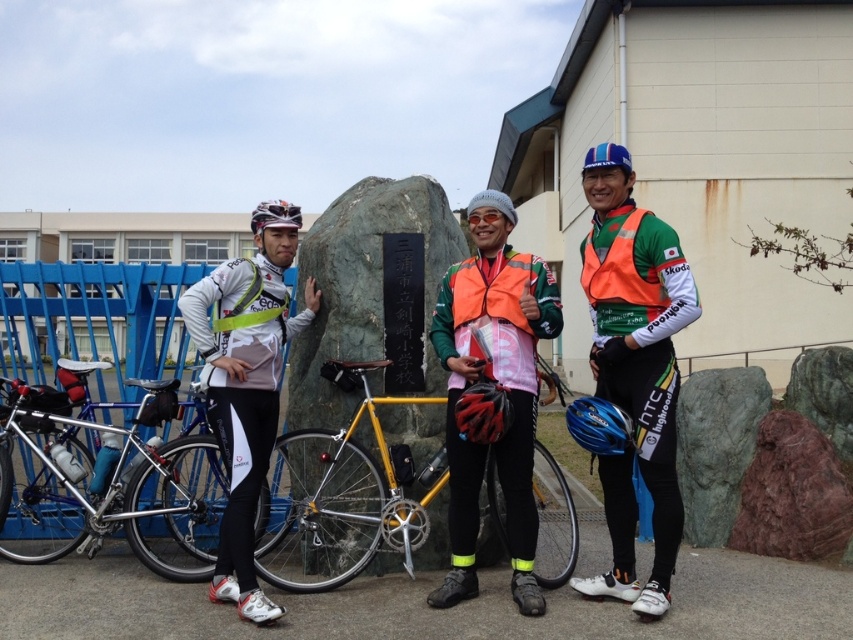
Question: Is green polished stone at center below blue matte bicycle helmet at center?

Choices:
 (A) yes
 (B) no

Answer: (B)

Question: Estimate the real-world distances between objects in this image. Which object is closer to the green polished stone at center?

Choices:
 (A) black matte bicycle helmet at center
 (B) yellow metallic bicycle at center

Answer: (B)

Question: Can you confirm if green fabric vest at center is wider than black matte bicycle helmet at center?

Choices:
 (A) yes
 (B) no

Answer: (A)

Question: Which of the following is the closest to the observer?

Choices:
 (A) green fabric vest at center
 (B) yellow metallic bicycle at center
 (C) green polished stone at center
 (D) blue matte bicycle helmet at center

Answer: (A)

Question: Which of the following is the farthest from the observer?

Choices:
 (A) (326, 321)
 (B) (28, 445)

Answer: (B)

Question: Does silver metallic bicycle at left have a larger size compared to black matte bicycle helmet at center?

Choices:
 (A) yes
 (B) no

Answer: (A)